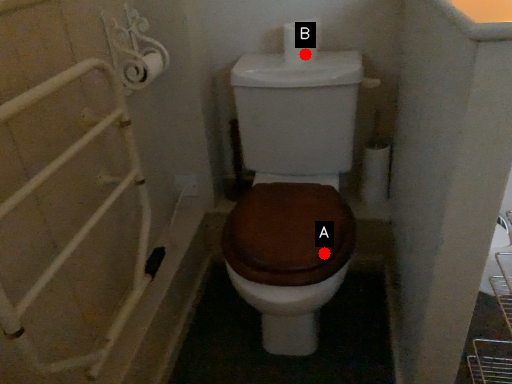
Question: Two points are circled on the image, labeled by A and B beside each circle. Among these points, which one is farthest from the camera?

Choices:
 (A) A is further
 (B) B is further

Answer: (B)